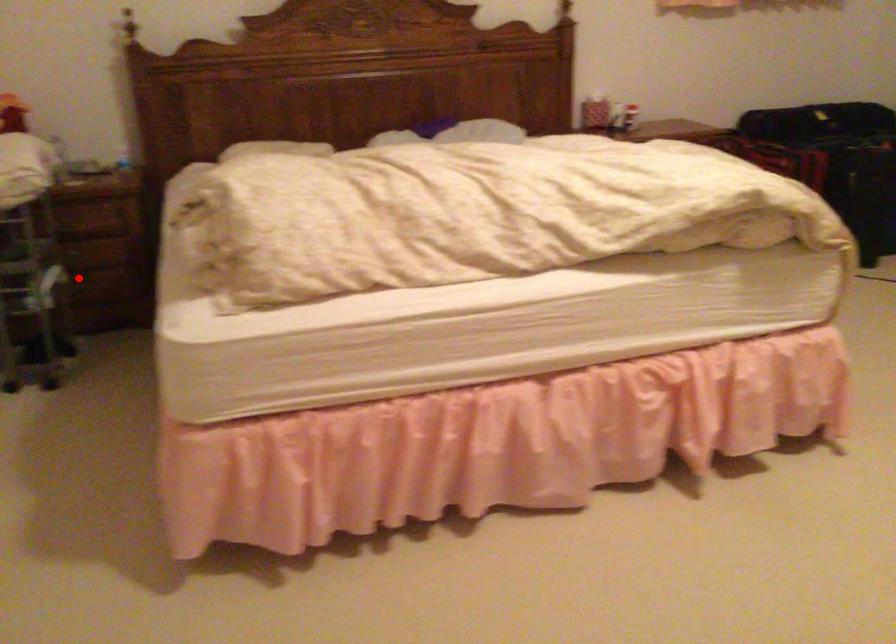
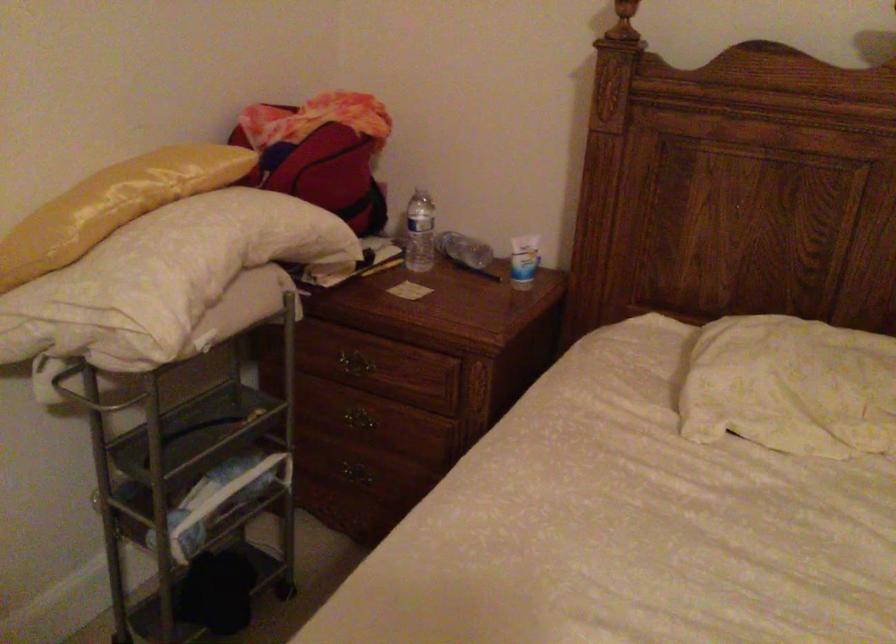
The point at the highlighted location is marked in the first image. Where is the corresponding point in the second image?

(355, 473)